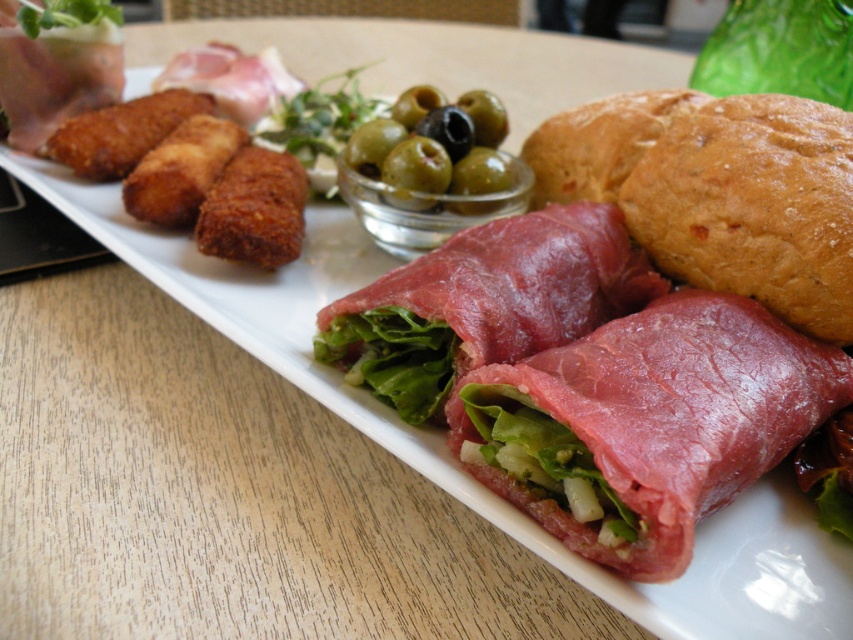
Question: Which object is positioned farthest from the fried golden-brown croquette at center-left?

Choices:
 (A) golden brown crusty bread at upper right
 (B) green glossy olives at center

Answer: (A)

Question: Which is farther from the baked golden-brown bread at right?

Choices:
 (A) golden brown crusty bread at upper right
 (B) pink raw meat at center
 (C) fried golden-brown croquette at center-left
 (D) pink glossy meat at center

Answer: (C)

Question: From the image, what is the correct spatial relationship of pink glossy meat at center in relation to fried golden-brown croquette at center-left?

Choices:
 (A) right
 (B) left

Answer: (A)

Question: Which of these objects is positioned farthest from the crispy golden-brown croquette at upper left?

Choices:
 (A) green glossy olives at center
 (B) fried golden-brown croquette at upper left
 (C) baked golden-brown bread at right

Answer: (C)

Question: Does golden brown crusty bread at upper right appear on the left side of crispy golden-brown croquette at upper left?

Choices:
 (A) yes
 (B) no

Answer: (B)

Question: Does pink glossy meat at center come behind golden brown crusty bread at upper right?

Choices:
 (A) no
 (B) yes

Answer: (A)